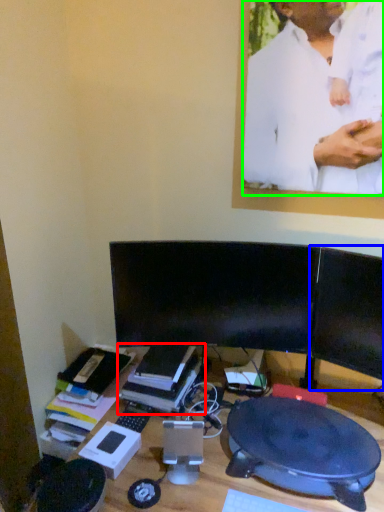
Question: Estimate the real-world distances between objects in this image. Which object is farther from book (highlighted by a red box), computer monitor (highlighted by a blue box) or man (highlighted by a green box)?

Choices:
 (A) computer monitor
 (B) man

Answer: (B)